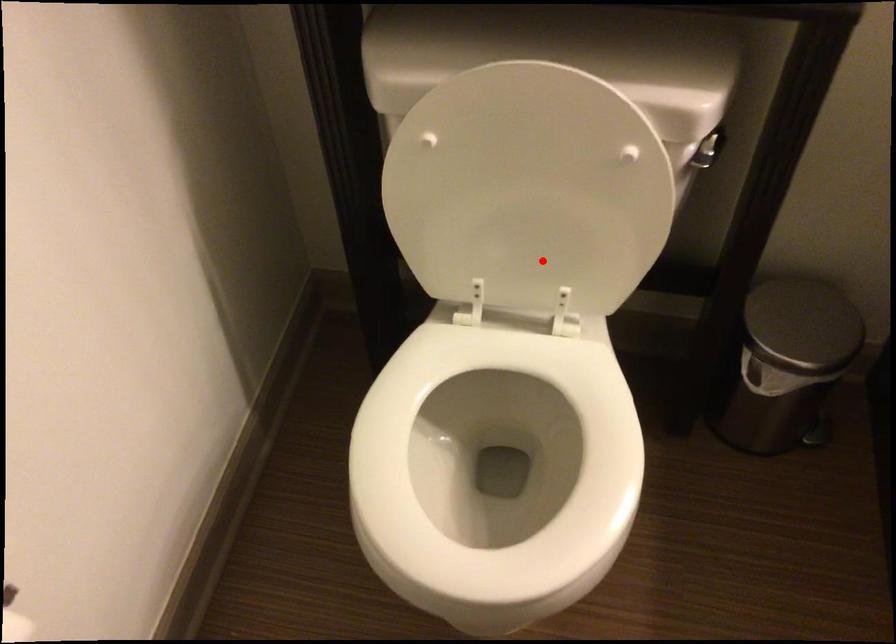
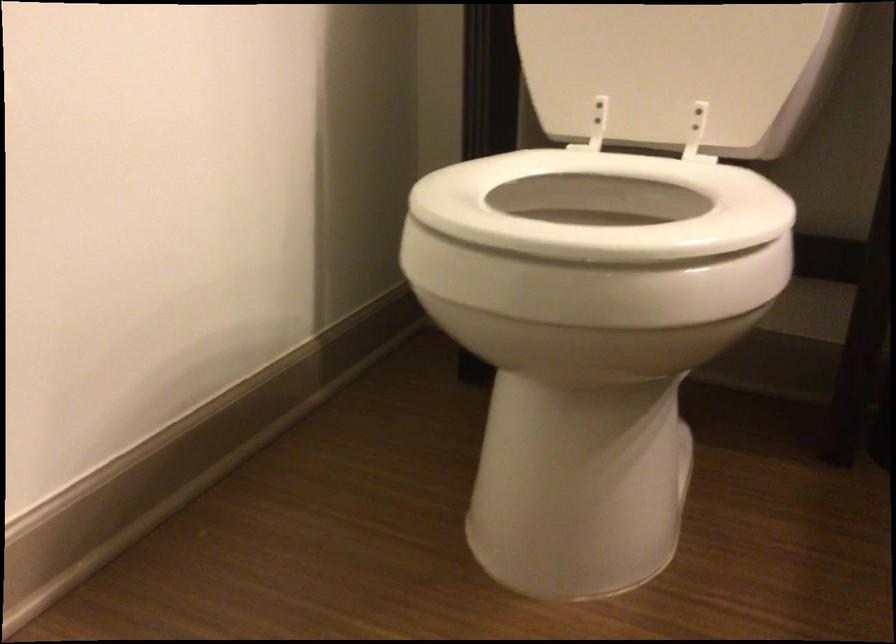
Question: I am providing you with two images of the same scene from different viewpoints. Given a red point in image1, look at the same physical point in image2. Is it:

Choices:
 (A) Closer to the viewpoint
 (B) Farther from the viewpoint

Answer: (A)